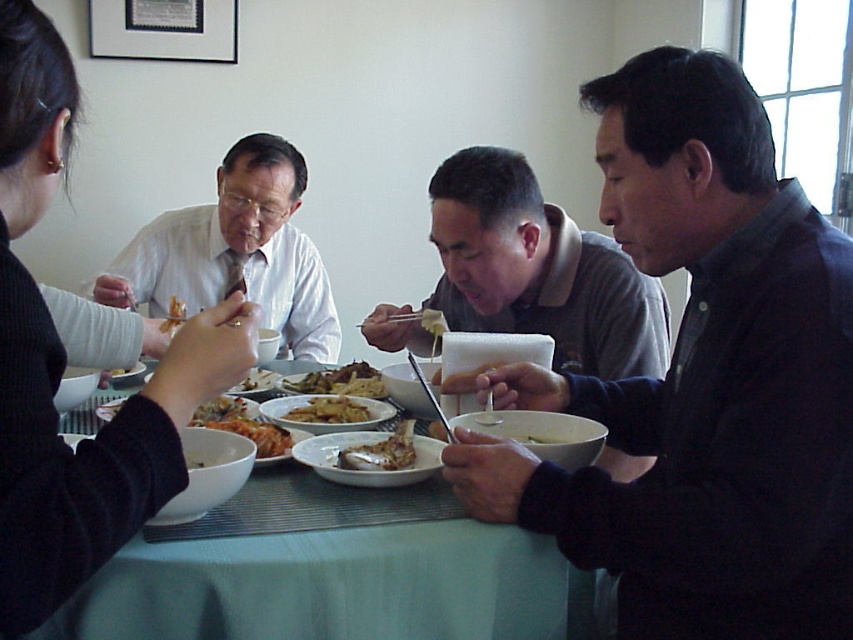
Is golden fried chicken at center below yellowish matte vegetable at center?

Indeed, golden fried chicken at center is positioned under yellowish matte vegetable at center.

Does golden fried chicken at center have a greater width compared to yellowish matte vegetable at center?

Yes.

Who is more distant from viewer, (242, 426) or (428, 332)?

The point (428, 332) is more distant.

The width and height of the screenshot is (853, 640). What are the coordinates of `golden fried chicken at center` in the screenshot? It's located at (254, 433).

Does gray matte shirt at center have a lesser height compared to yellowish matte vegetable at center?

Incorrect, gray matte shirt at center's height does not fall short of yellowish matte vegetable at center's.

Is gray matte shirt at center positioned behind yellowish matte vegetable at center?

No, it is in front of yellowish matte vegetable at center.

Is point (596, 289) farther from viewer compared to point (426, 317)?

No, (596, 289) is closer to viewer.

Locate an element on the screen. The height and width of the screenshot is (640, 853). gray matte shirt at center is located at coordinates (538, 269).

Which is more to the right, dark gray sweater at right or golden crispy fried chicken at center?

dark gray sweater at right is more to the right.

Who is more forward, (656, 413) or (329, 422)?

Point (656, 413) is more forward.

You are a GUI agent. You are given a task and a screenshot of the screen. Output one action in this format:
    pyautogui.click(x=<x>, y=<y>)
    Task: Click on the dark gray sweater at right
    The image size is (853, 640).
    Given the screenshot: What is the action you would take?
    pyautogui.click(x=701, y=380)

The width and height of the screenshot is (853, 640). I want to click on dark gray sweater at right, so click(x=701, y=380).